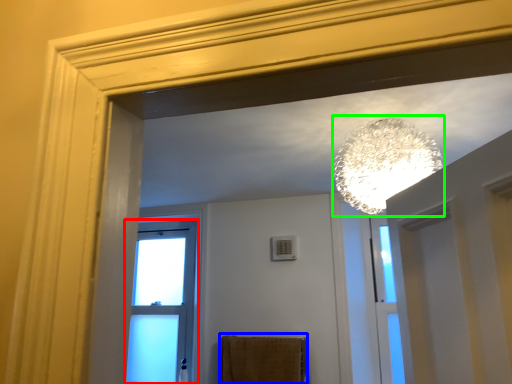
Question: Which is nearer to the window (highlighted by a red box)? bath towel (highlighted by a blue box) or lamp (highlighted by a green box).

Choices:
 (A) bath towel
 (B) lamp

Answer: (A)